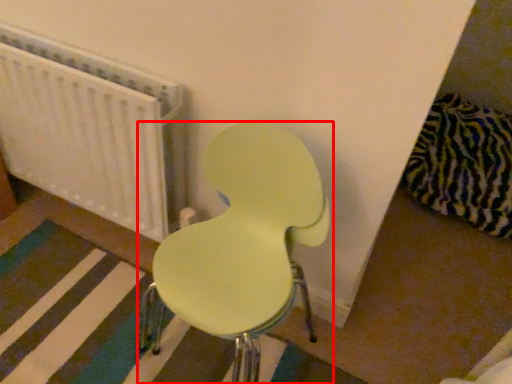
Question: From the image's perspective, where is chair (annotated by the red box) located in relation to radiator in the image?

Choices:
 (A) above
 (B) below

Answer: (B)